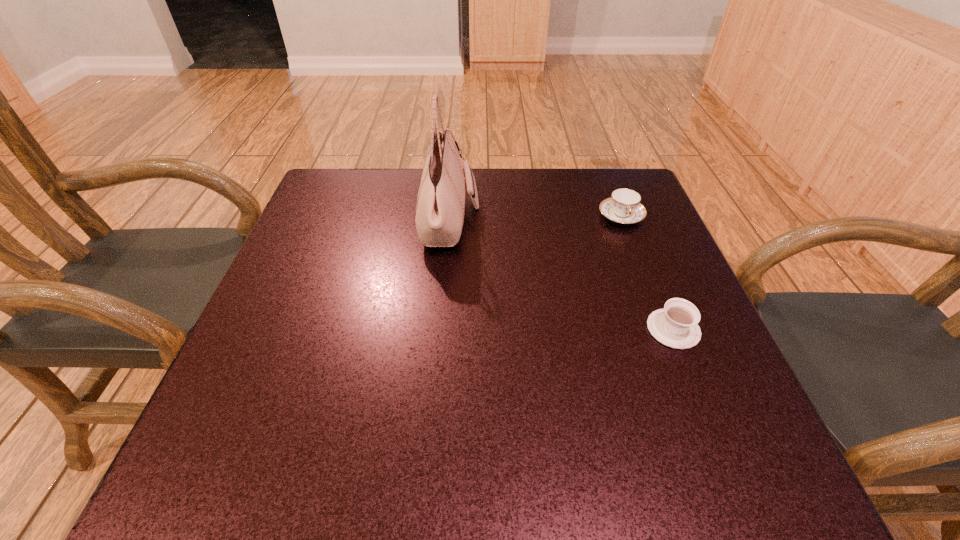
The image size is (960, 540). I want to click on handbag positioned at the far edge, so click(440, 207).

Find the location of a particular element. teacup that is at the far edge is located at coordinates (624, 206).

You are a GUI agent. You are given a task and a screenshot of the screen. Output one action in this format:
    pyautogui.click(x=<x>, y=<y>)
    Task: Click on the object that is at the far right corner
    The width and height of the screenshot is (960, 540).
    Given the screenshot: What is the action you would take?
    pyautogui.click(x=624, y=206)

At what (x,y) coordinates should I click in order to perform the action: click on blank area at the far edge. Please return your answer as a coordinate pair (x, y). The height and width of the screenshot is (540, 960). Looking at the image, I should click on (508, 207).

The width and height of the screenshot is (960, 540). In the image, there is a desktop. Find the location of `vacant space at the near edge`. vacant space at the near edge is located at coordinates (567, 468).

The width and height of the screenshot is (960, 540). I want to click on free space at the left edge of the desktop, so click(x=304, y=276).

In the image, there is a desktop. Where is `vacant space at the right edge`? The width and height of the screenshot is (960, 540). vacant space at the right edge is located at coordinates (668, 253).

This screenshot has width=960, height=540. I want to click on free region at the far left corner of the desktop, so click(x=361, y=211).

Identify the location of vacant position at the near left corner of the desktop. The image size is (960, 540). (265, 477).

At what (x,y) coordinates should I click in order to perform the action: click on unoccupied position between the farther teacup and the leftmost object. Please return your answer as a coordinate pair (x, y). This screenshot has height=540, width=960. Looking at the image, I should click on (536, 218).